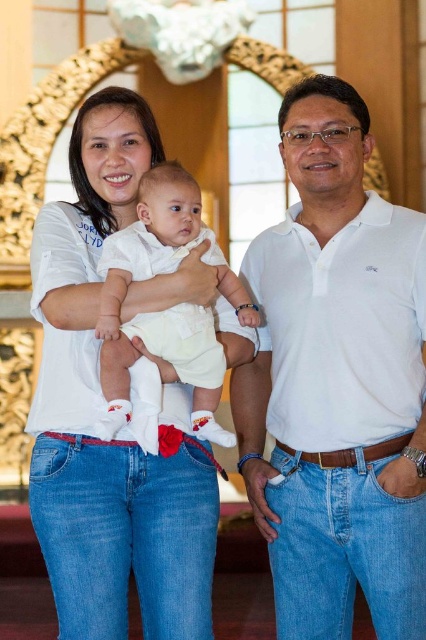
Question: Is white cotton polo shirt at center bigger than white cotton baby at center?

Choices:
 (A) yes
 (B) no

Answer: (A)

Question: Is white cotton polo shirt at center positioned at the back of white cotton baby at center?

Choices:
 (A) no
 (B) yes

Answer: (A)

Question: Can you confirm if white cotton polo shirt at center is wider than white cotton baby at center?

Choices:
 (A) no
 (B) yes

Answer: (B)